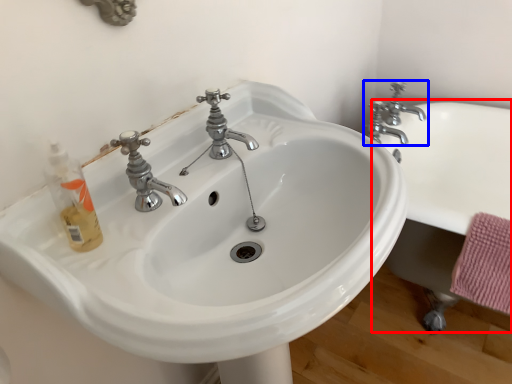
Question: Which of the following is the closest to the observer, bath (highlighted by a red box) or tap (highlighted by a blue box)?

Choices:
 (A) bath
 (B) tap

Answer: (A)